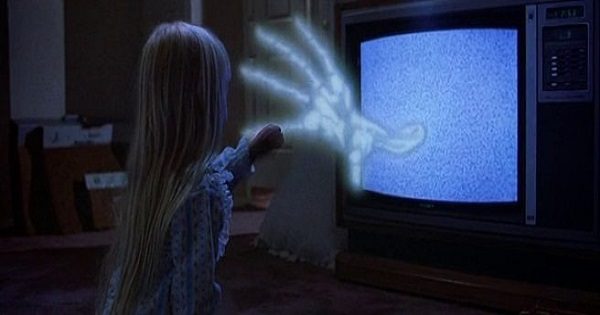
At what (x,y) coordinates should I click in order to perform the action: click on static on tv. Please return your answer as a coordinate pair (x, y). The height and width of the screenshot is (315, 600). Looking at the image, I should click on (442, 111).